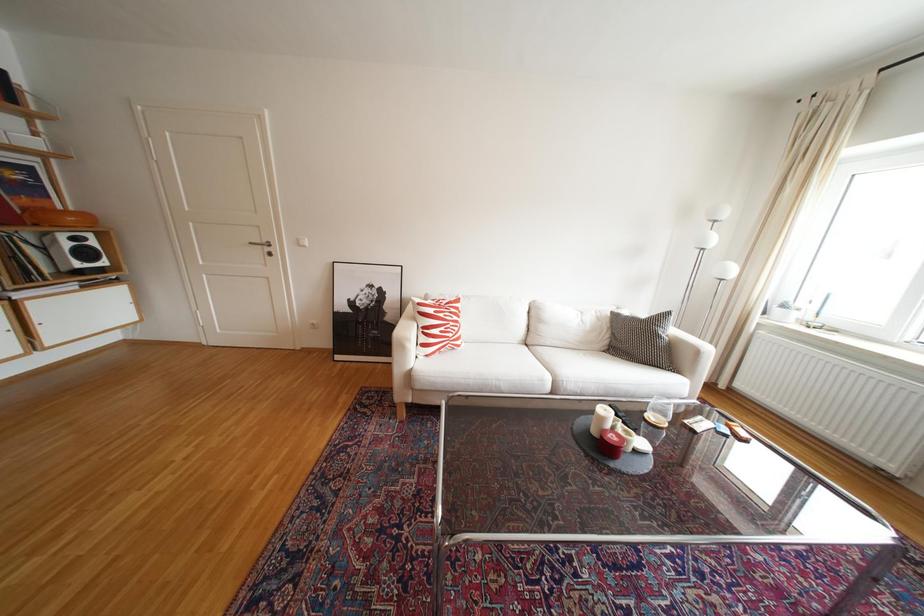
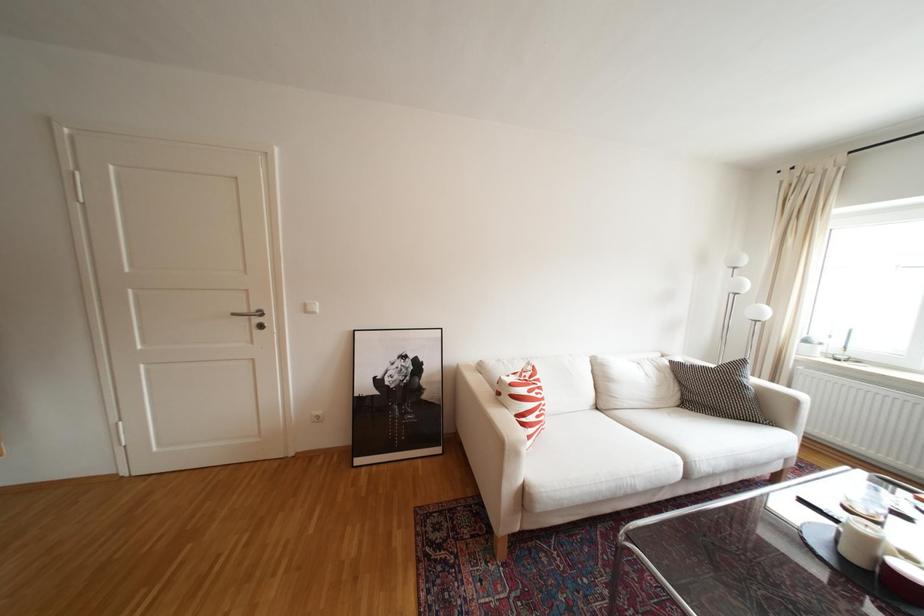
Question: The camera is either moving clockwise (left) or counter-clockwise (right) around the object. The first image is from the beginning of the video and the second image is from the end. Is the camera moving left or right when shooting the video?

Choices:
 (A) Left
 (B) Right

Answer: (A)